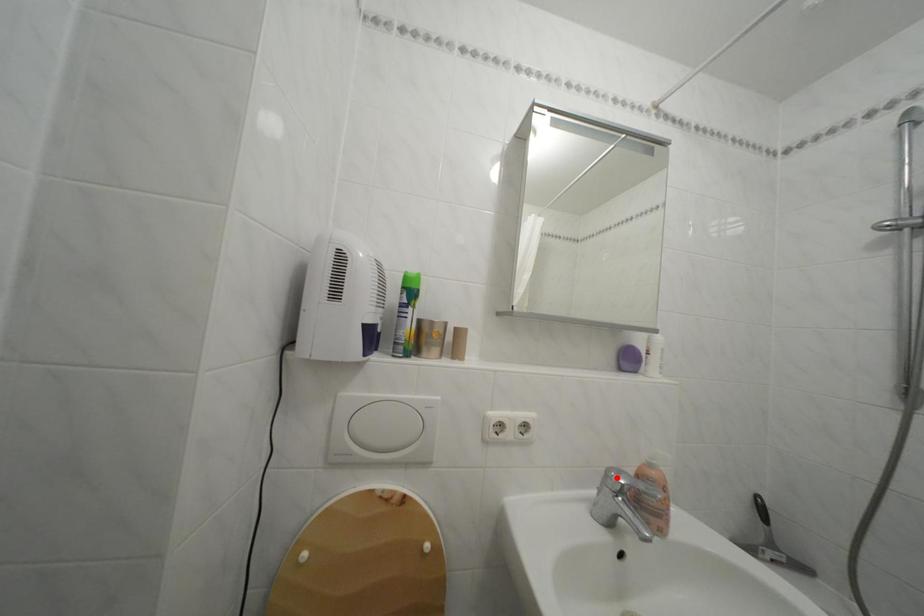
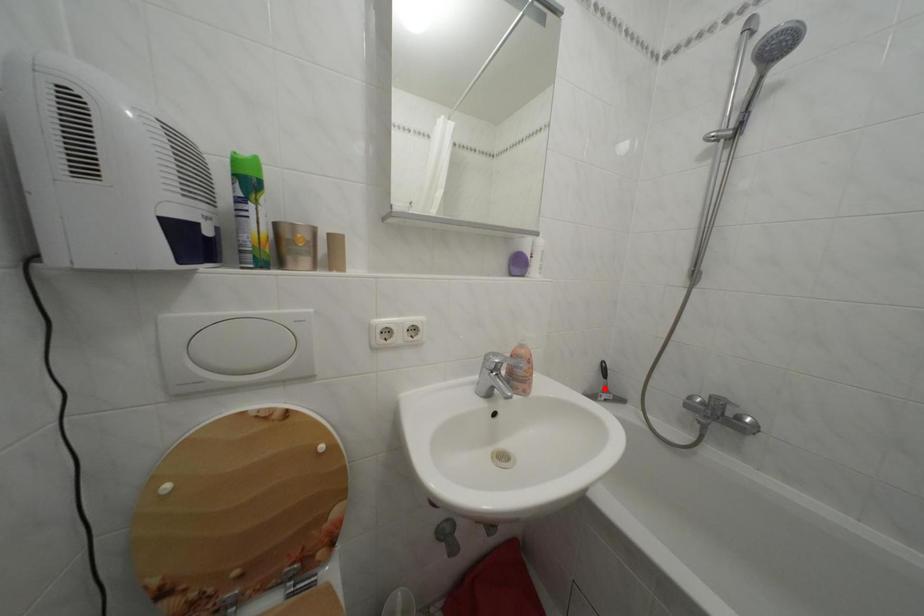
I am providing you with two images of the same scene from different viewpoints. A red point is marked on the first image and another point is marked on the second image. Does the point marked in image1 correspond to the same location as the one in image2?

No